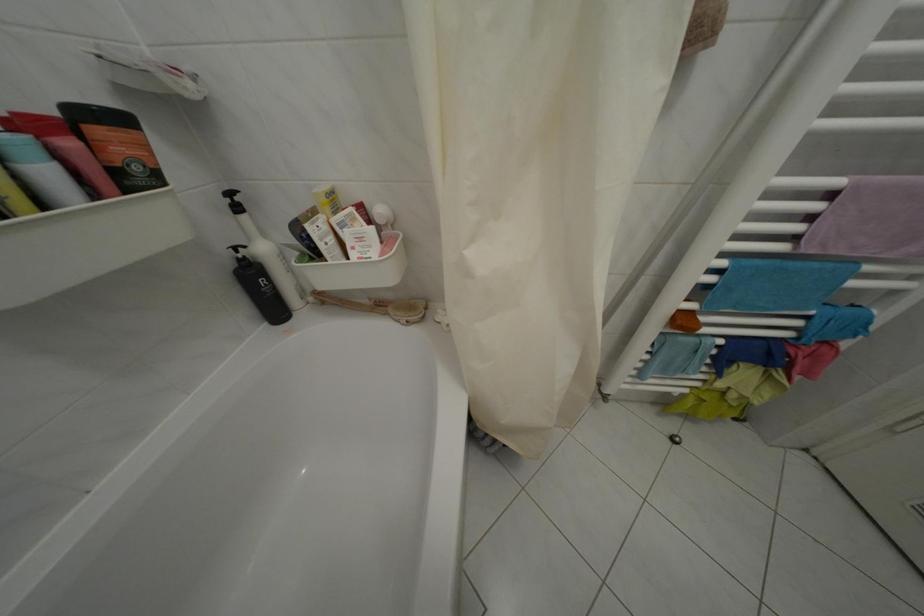
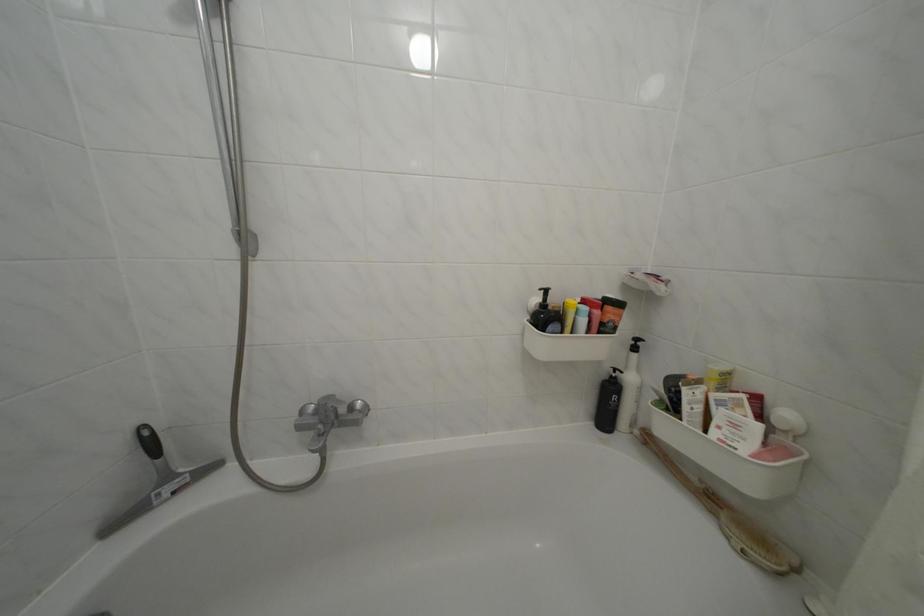
Where in the second image is the point corresponding to (x=391, y=260) from the first image?

(766, 462)